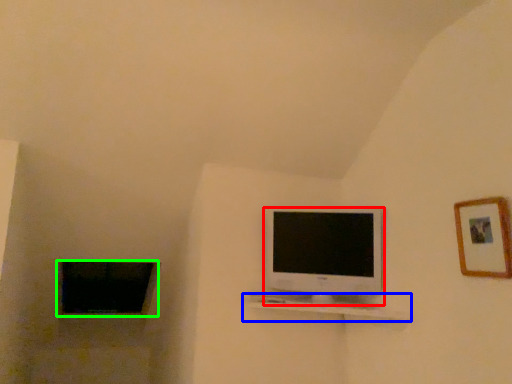
Question: Which is nearer to the television (highlighted by a red box)? shelf (highlighted by a blue box) or window (highlighted by a green box).

Choices:
 (A) shelf
 (B) window

Answer: (A)